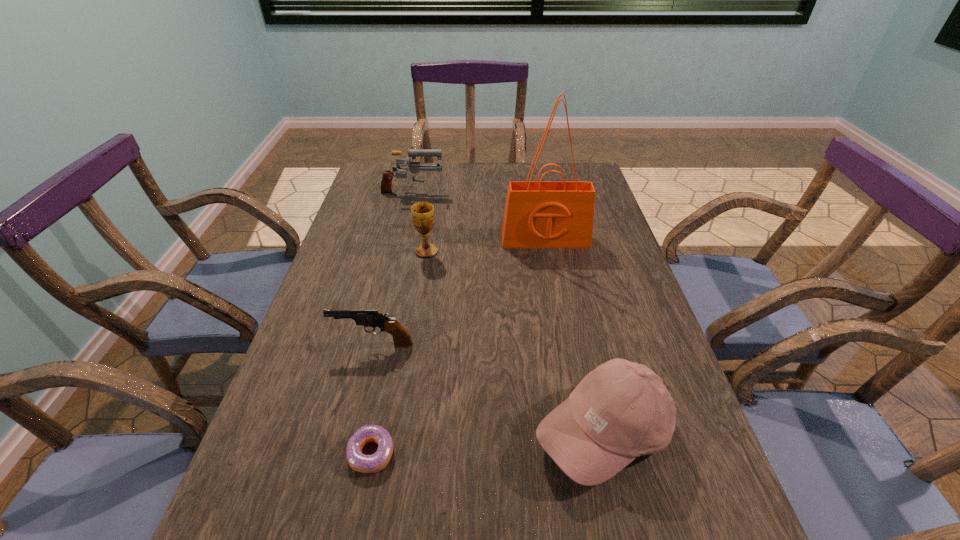
The width and height of the screenshot is (960, 540). What are the coordinates of `free space at the far left corner` in the screenshot? It's located at (365, 195).

You are a GUI agent. You are given a task and a screenshot of the screen. Output one action in this format:
    pyautogui.click(x=<x>, y=<y>)
    Task: Click on the vacant space that is in between the shortest object and the tallest object
    This screenshot has height=540, width=960.
    Given the screenshot: What is the action you would take?
    [x=458, y=347]

The height and width of the screenshot is (540, 960). I want to click on vacant area that lies between the farthest object and the tallest object, so click(479, 217).

At what (x,y) coordinates should I click in order to perform the action: click on free space between the tote bag and the shortest object. Please return your answer as a coordinate pair (x, y). The height and width of the screenshot is (540, 960). Looking at the image, I should click on (458, 347).

This screenshot has width=960, height=540. What are the coordinates of `vacant space that is in between the tote bag and the second shortest object` in the screenshot? It's located at (459, 292).

I want to click on free area in between the chalice and the shortest object, so click(399, 353).

The image size is (960, 540). I want to click on blank region between the shortest object and the baseball cap, so click(x=488, y=443).

Find the location of a particular element. The width and height of the screenshot is (960, 540). free spot between the baseball cap and the fifth tallest object is located at coordinates (488, 389).

Identify the location of unoccupied area between the baseball cap and the chalice. coord(515,342).

Where is `object that stands as the third closest to the tallest object`? object that stands as the third closest to the tallest object is located at coordinates (368, 318).